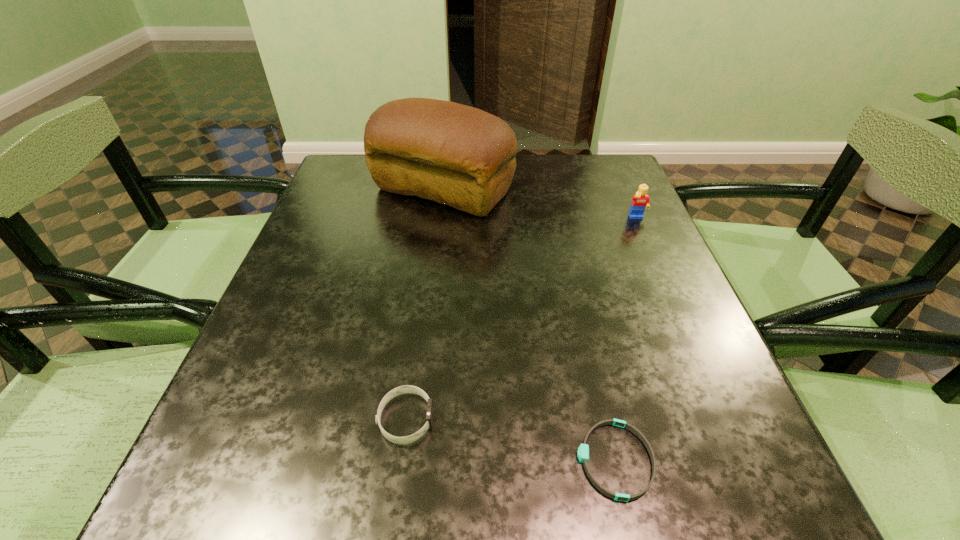
Find the location of `the tallest object`. the tallest object is located at coordinates (457, 155).

This screenshot has height=540, width=960. I want to click on the rightmost object, so click(x=641, y=200).

This screenshot has height=540, width=960. I want to click on the second tallest object, so click(641, 200).

You are a GUI agent. You are given a task and a screenshot of the screen. Output one action in this format:
    pyautogui.click(x=<x>, y=<y>)
    Task: Click on the taller wristband
    
    Given the screenshot: What is the action you would take?
    pyautogui.click(x=404, y=389)

The width and height of the screenshot is (960, 540). Identify the location of the left wristband. (404, 389).

Locate an element on the screen. The image size is (960, 540). the shorter wristband is located at coordinates (583, 451).

Locate an element on the screen. Image resolution: width=960 pixels, height=540 pixels. the shortest object is located at coordinates (583, 451).

Image resolution: width=960 pixels, height=540 pixels. What are the coordinates of `free spot located on the right of the bread` in the screenshot? It's located at 542,190.

I want to click on vacant space located on the face of the Lego, so pos(693,346).

Where is `vacant region located on the outer surface of the second shortest object`? This screenshot has height=540, width=960. vacant region located on the outer surface of the second shortest object is located at coordinates (519, 419).